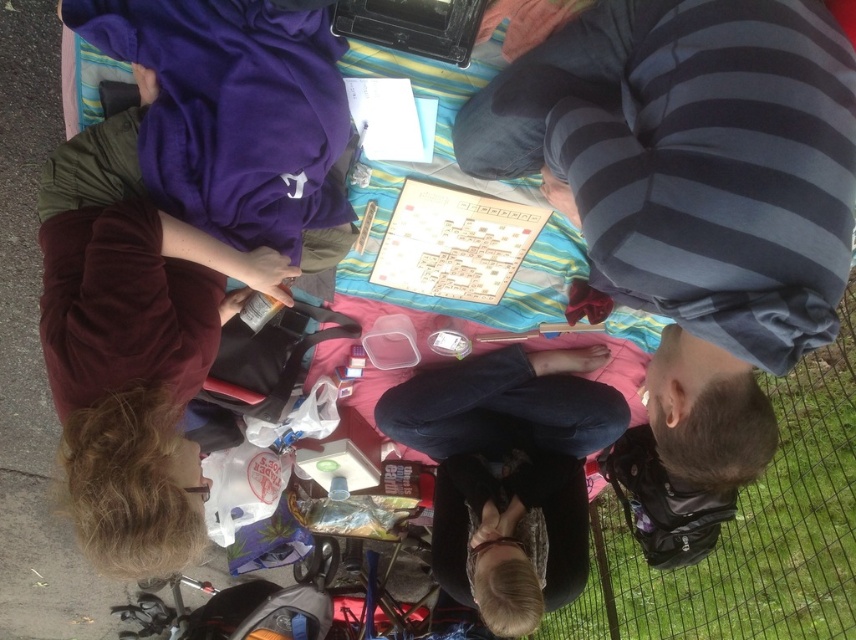
You are a photographer trying to capture a wide shot of the scene. The dark blue jeans at center and the wooden picnic table at center are both in the frame. Based on their sizes, which object would appear larger in the photo?

The dark blue jeans at center would appear larger in the photo since they are wider than the wooden picnic table at center according to the description.

You are a person who wants to place a small snack between the dark blue jeans at center and the wooden picnic table at center. How far apart are these two objects?

The dark blue jeans at center is 32.94 inches from the wooden picnic table at center.

You are a photographer trying to capture a candid shot of the striped cotton shirt at upper right without the camera being visible in the frame. Given the distance between them, can you position yourself in such a way that the camera is hidden from the shirt wearer while maintaining a clear view of the shirt?

The striped cotton shirt at upper right and camera are 30.76 inches apart. By positioning the camera behind an object or angling it discreetly, you can maintain a clear view of the striped cotton shirt at upper right while keeping the camera out of the frame.